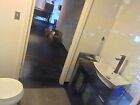
Find the location of a particular element. This screenshot has width=140, height=105. wall to the left of sink is located at coordinates (93, 31).